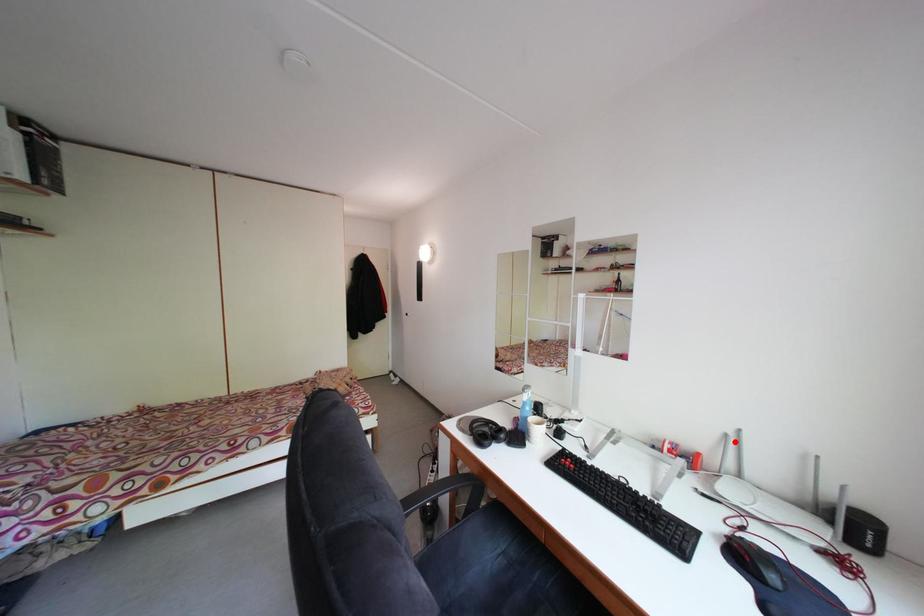
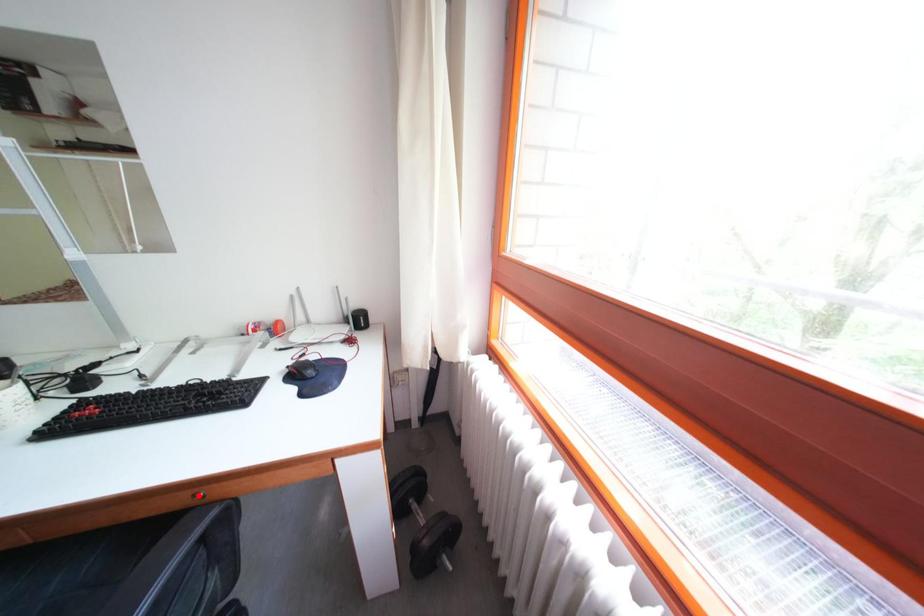
I am providing you with two images of the same scene from different viewpoints. A red point is marked on the first image and another point is marked on the second image. Is the marked point in image1 the same physical position as the marked point in image2?

No